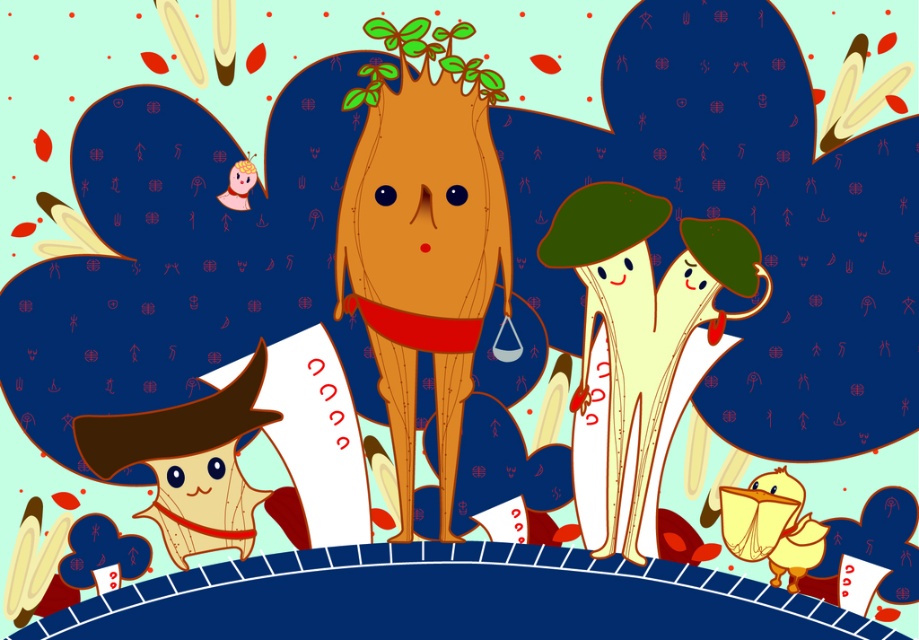
In the scene shown: Based on the scene description, where is the smooth brown tree trunk at center located in terms of its 2D coordinates?

The smooth brown tree trunk at center is located at the 2D coordinates of point (423, 241).

You are standing in the scene and want to see both the smooth brown tree trunk at center and the smooth cream mushrooms at center. Which object is closer to you?

The smooth brown tree trunk at center is closer to you because the smooth cream mushrooms at center are behind it.

You are a small creature trying to jump from the smooth brown tree trunk at center to the smooth cream mushrooms at center. The distance between them is 10.41 inches. Can you make the jump if your maximum jump distance is 10 inches?

The smooth brown tree trunk at center and smooth cream mushrooms at center are 10.41 inches apart. Since your maximum jump distance is 10 inches, you cannot make the jump as the distance is slightly longer than your capability.